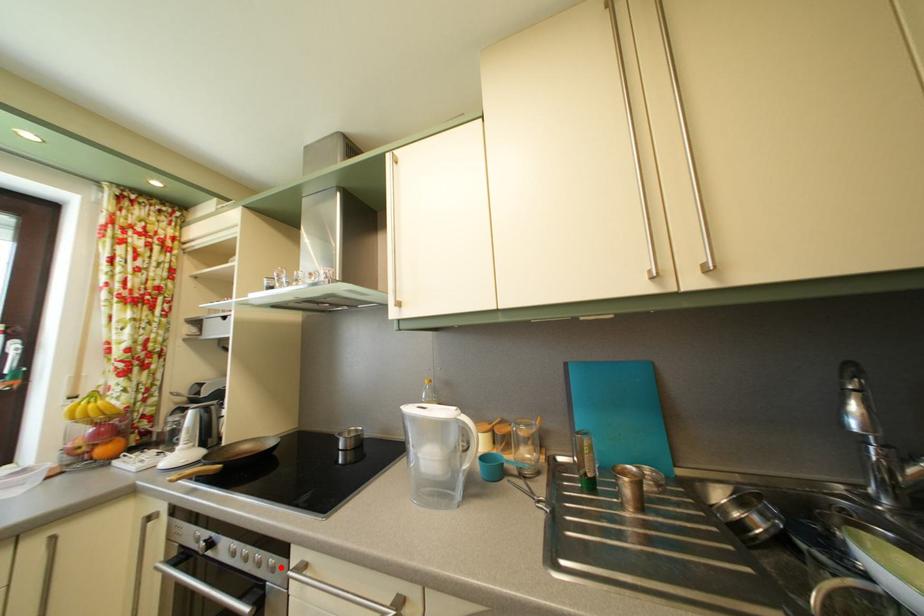
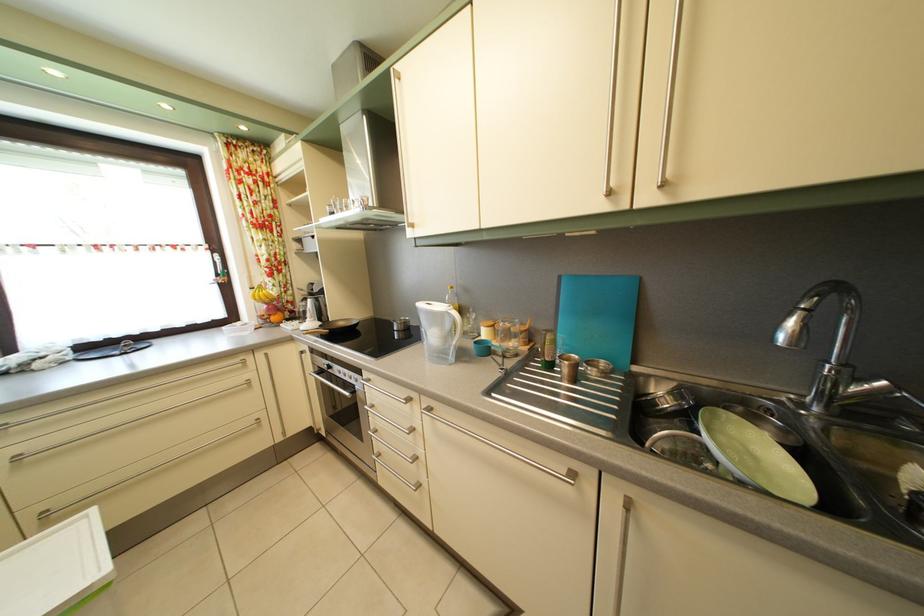
Question: I am providing you with two images of the same scene from different viewpoints. A red point is shown in image1. For the corresponding object point in image2, is it positioned nearer or farther from the camera?

Choices:
 (A) Nearer
 (B) Farther

Answer: (B)